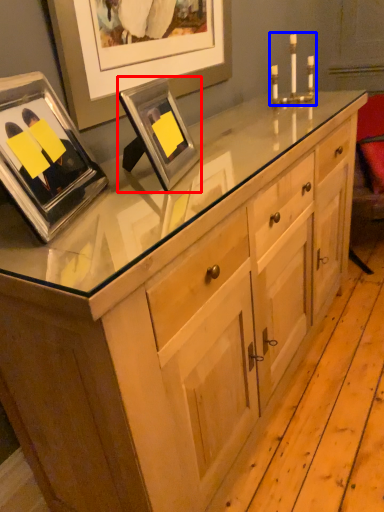
Question: Among these objects, which one is nearest to the camera, picture frame (highlighted by a red box) or candle holder (highlighted by a blue box)?

Choices:
 (A) picture frame
 (B) candle holder

Answer: (A)